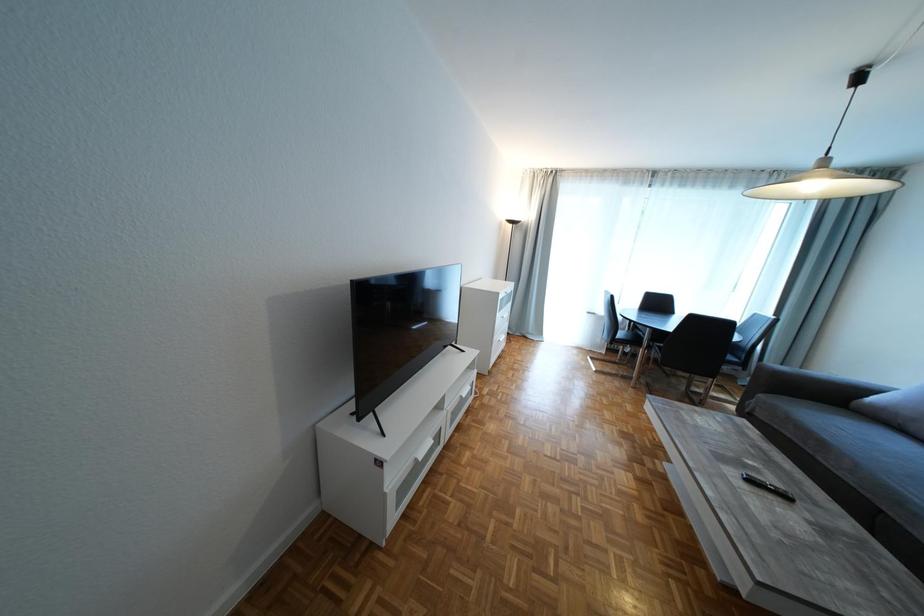
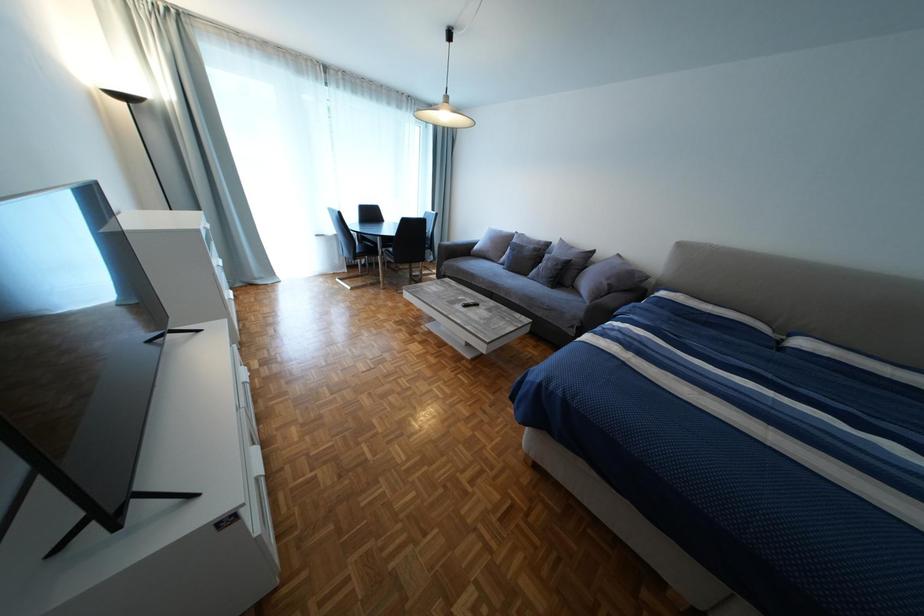
How did the camera likely rotate?

The camera's rotation is toward right-down.